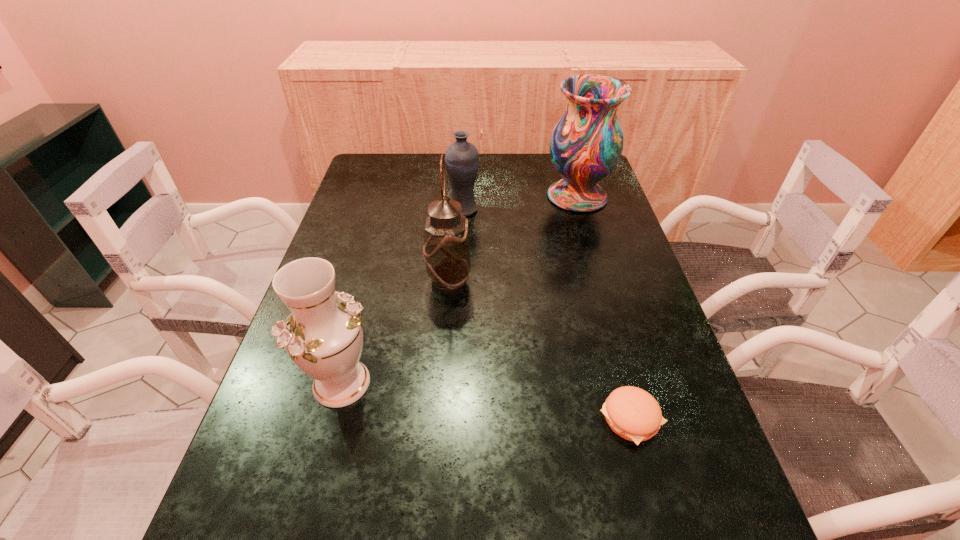
The image size is (960, 540). Find the location of `the closest vase to the third nearest object`. the closest vase to the third nearest object is located at coordinates (323, 335).

Locate an element on the screen. vase that is the closest to the shortest vase is located at coordinates (586, 144).

Where is `vacant space that satisfies the following two spatial constraints: 1. on the back side of the oil lamp; 2. on the right side of the shortest vase`? vacant space that satisfies the following two spatial constraints: 1. on the back side of the oil lamp; 2. on the right side of the shortest vase is located at coordinates (454, 208).